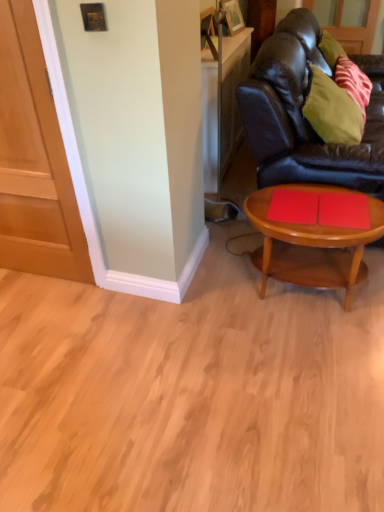
Question: Is point (372, 79) closer or farther from the camera than point (340, 90)?

Choices:
 (A) farther
 (B) closer

Answer: (A)

Question: Which is correct: black leather couch at right is inside green fabric pillow at upper right, or outside of it?

Choices:
 (A) inside
 (B) outside

Answer: (B)

Question: Estimate the real-world distances between objects in this image. Which object is closer to the wooden coffee table at lower right?

Choices:
 (A) green fabric pillow at upper right
 (B) black leather couch at right
 (C) matte wood door at left

Answer: (A)

Question: Estimate the real-world distances between objects in this image. Which object is farther from the green fabric pillow at upper right?

Choices:
 (A) matte wood door at left
 (B) wooden coffee table at lower right
 (C) black leather couch at right

Answer: (A)